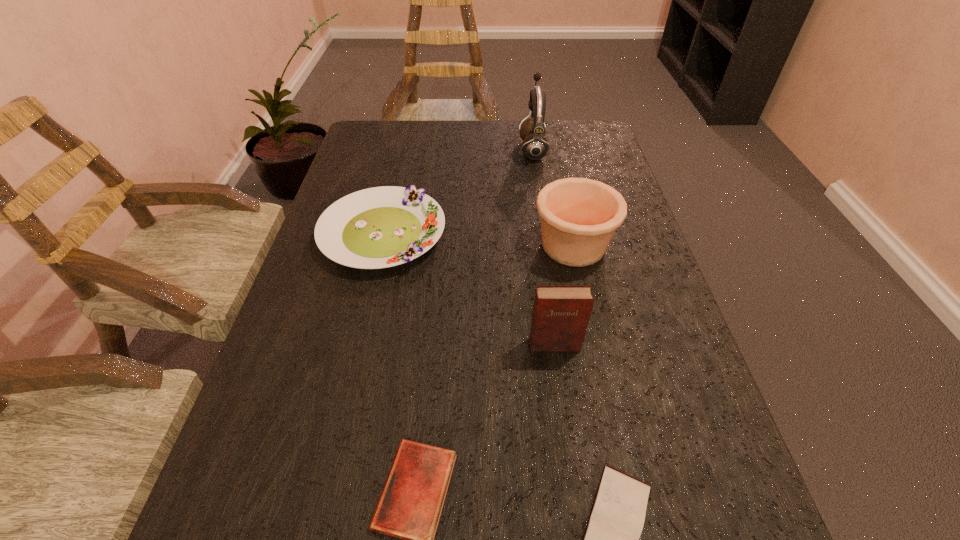
Identify which object is the fourth closest to the second shortest object. Please provide its 2D coordinates. Your answer should be formatted as a tuple, i.e. [(x, y)], where the tuple contains the x and y coordinates of a point satisfying the conditions above.

[(380, 227)]

You are a GUI agent. You are given a task and a screenshot of the screen. Output one action in this format:
    pyautogui.click(x=<x>, y=<y>)
    Task: Click on the object that stands as the second closest to the salad plate
    
    Given the screenshot: What is the action you would take?
    pyautogui.click(x=561, y=313)

Locate an element on the screen. diary that is the second closest to the leftmost diary is located at coordinates (561, 313).

This screenshot has height=540, width=960. I want to click on diary that stands as the closest to the second shortest diary, so click(410, 505).

Image resolution: width=960 pixels, height=540 pixels. What are the coordinates of `free location that satisfies the following two spatial constraints: 1. on the ear pads of the earphone; 2. on the front cover of the tallest diary` in the screenshot? It's located at (x=564, y=345).

Locate an element on the screen. free point that satisfies the following two spatial constraints: 1. on the ear pads of the earphone; 2. on the front cover of the third nearest object is located at coordinates (564, 345).